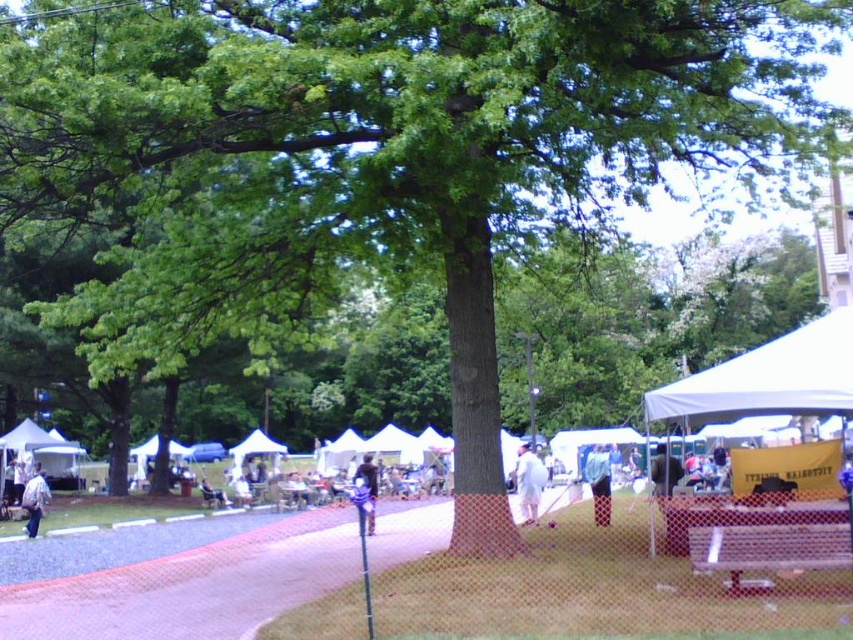
Is white fabric at center further to the viewer compared to denim jacket at center?

Yes, white fabric at center is further from the viewer.

Describe the element at coordinates (529, 483) in the screenshot. I see `white fabric at center` at that location.

The width and height of the screenshot is (853, 640). Describe the element at coordinates (529, 483) in the screenshot. I see `white fabric at center` at that location.

This screenshot has width=853, height=640. In order to click on white fabric at center in this screenshot , I will do `click(529, 483)`.

Does light blue denim jacket at lower left have a greater width compared to denim jacket at center?

Correct, the width of light blue denim jacket at lower left exceeds that of denim jacket at center.

Which is more to the right, light blue denim jacket at lower left or denim jacket at center?

From the viewer's perspective, denim jacket at center appears more on the right side.

Locate an element on the screen. The image size is (853, 640). light blue denim jacket at lower left is located at coordinates (33, 500).

Can you confirm if white fabric canopy at upper right is positioned to the right of blue denim jeans at center?

Correct, you'll find white fabric canopy at upper right to the right of blue denim jeans at center.

The image size is (853, 640). Describe the element at coordinates (767, 378) in the screenshot. I see `white fabric canopy at upper right` at that location.

Find the location of a particular element. The image size is (853, 640). white fabric canopy at upper right is located at coordinates (767, 378).